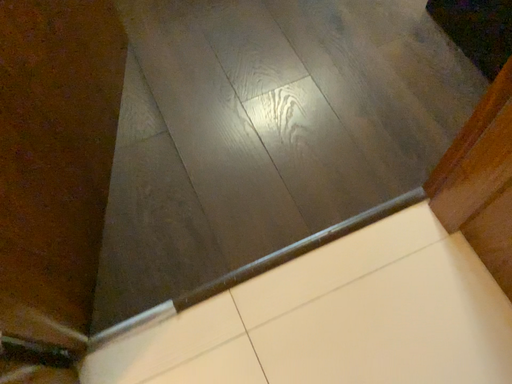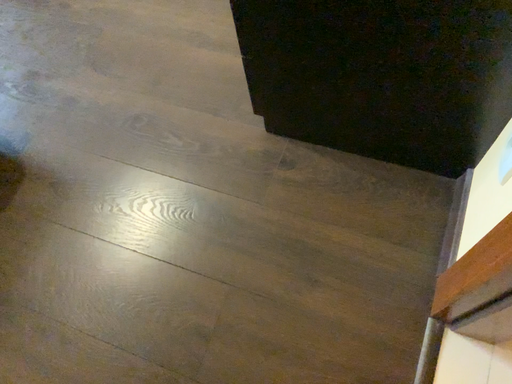
Question: Which way did the camera rotate in the video?

Choices:
 (A) rotated left
 (B) rotated right

Answer: (B)